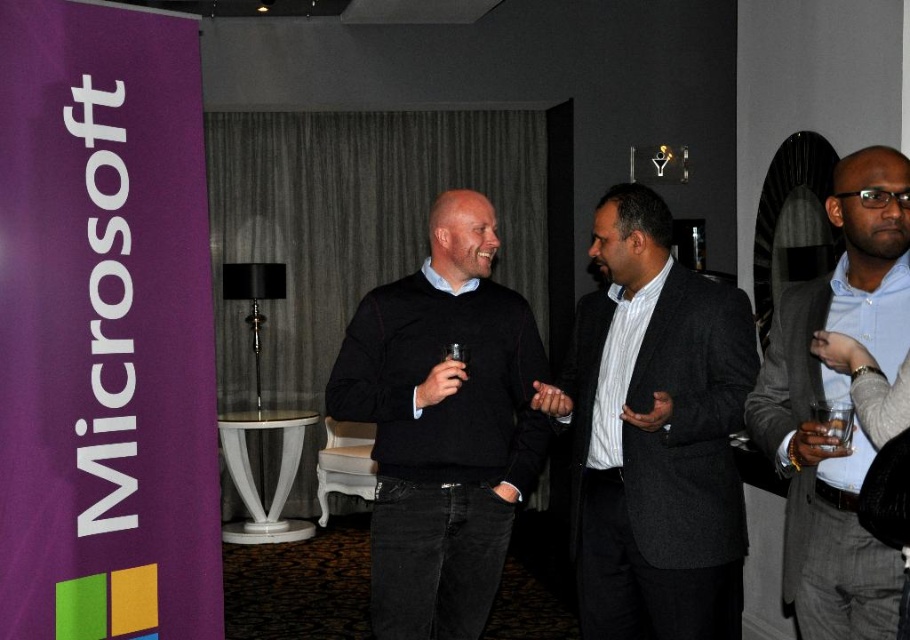
Is point (693, 320) farther from viewer compared to point (807, 557)?

That is True.

Which is in front, point (730, 365) or point (880, 269)?

Point (880, 269) is in front.

Identify the location of dark gray suit at center. Image resolution: width=910 pixels, height=640 pixels. (655, 433).

Who is more distant from viewer, (405, 275) or (814, 388)?

The point (405, 275) is more distant.

Between black sweater at center and light blue shirt at right, which one has less height?

Standing shorter between the two is light blue shirt at right.

Is point (433, 300) more distant than point (844, 449)?

That is True.

This screenshot has height=640, width=910. Find the location of `black sweater at center`. black sweater at center is located at coordinates (443, 426).

Does dark gray suit at center appear on the right side of black sweater at center?

Yes, dark gray suit at center is to the right of black sweater at center.

Image resolution: width=910 pixels, height=640 pixels. Identify the location of dark gray suit at center. (655, 433).